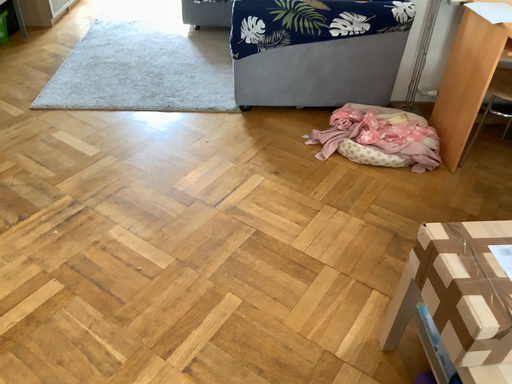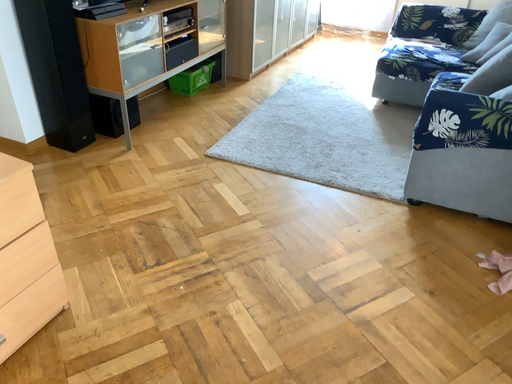
Question: How did the camera likely rotate when shooting the video?

Choices:
 (A) rotated downward
 (B) rotated upward

Answer: (B)